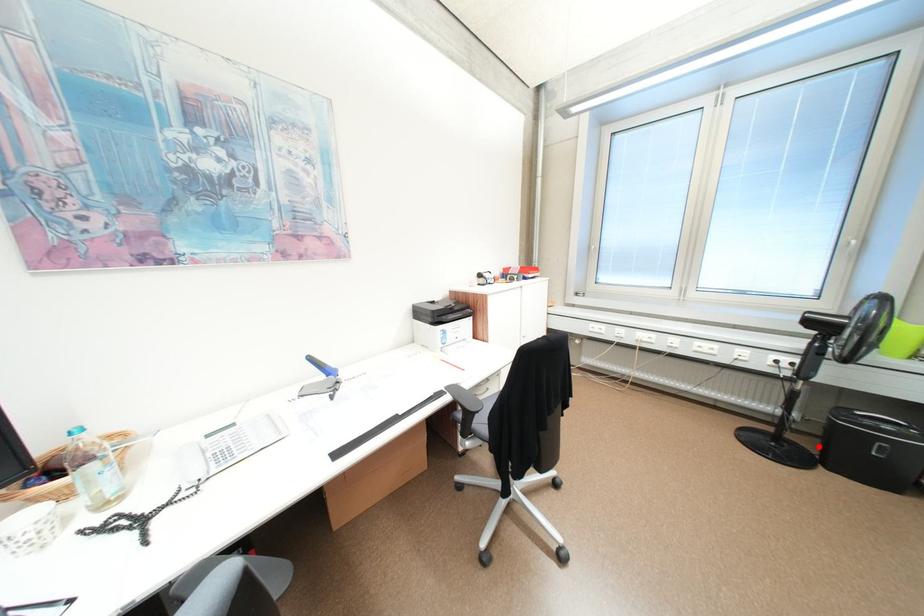
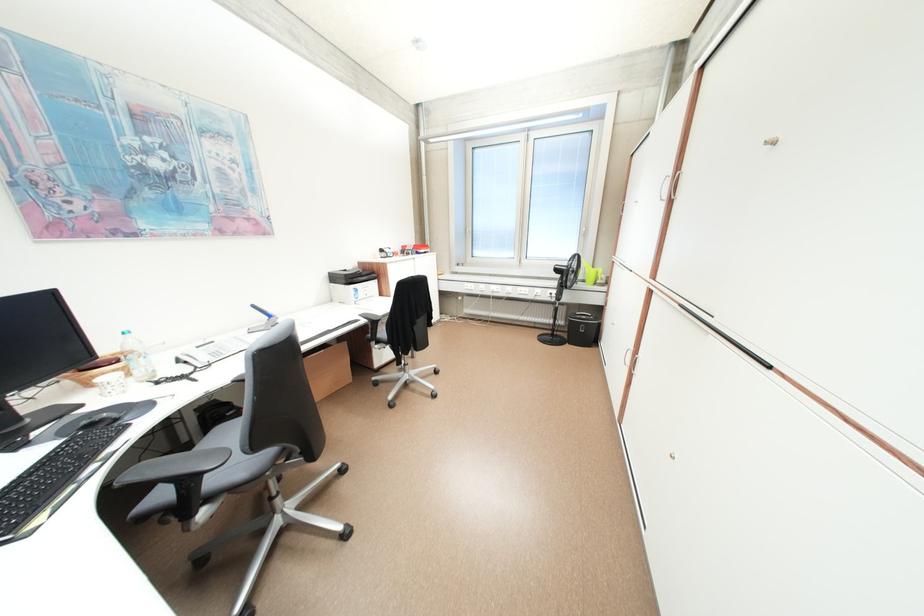
Question: I am providing you with two images of the same scene from different viewpoints. A red point is shown in image1. For the corresponding object point in image2, is it positioned nearer or farther from the camera?

Choices:
 (A) Nearer
 (B) Farther

Answer: (B)